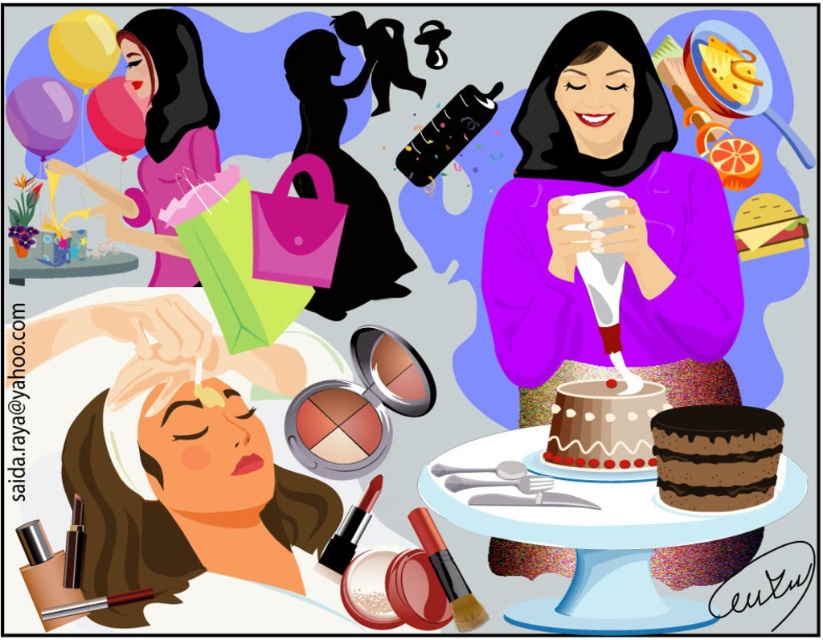
You are standing in the image and want to place a sticker at point (608, 227). What object will the sticker land on?

The sticker will land on the purple matte sweater at center because the point (608, 227) is on the purple matte sweater at center.

Please look at the image and tell me what object is located at the coordinates point (603, 424)?

The chocolate frosted cake at center is located at point (603, 424).

You are planning to take a photo of the chocolate frosted cake at center and the yellow matte balloon at upper left. Which object should be placed closer to the camera to ensure both are in focus?

The chocolate frosted cake at center is shorter than the yellow matte balloon at upper left, so to ensure both are in focus, the chocolate frosted cake at center should be placed closer to the camera.